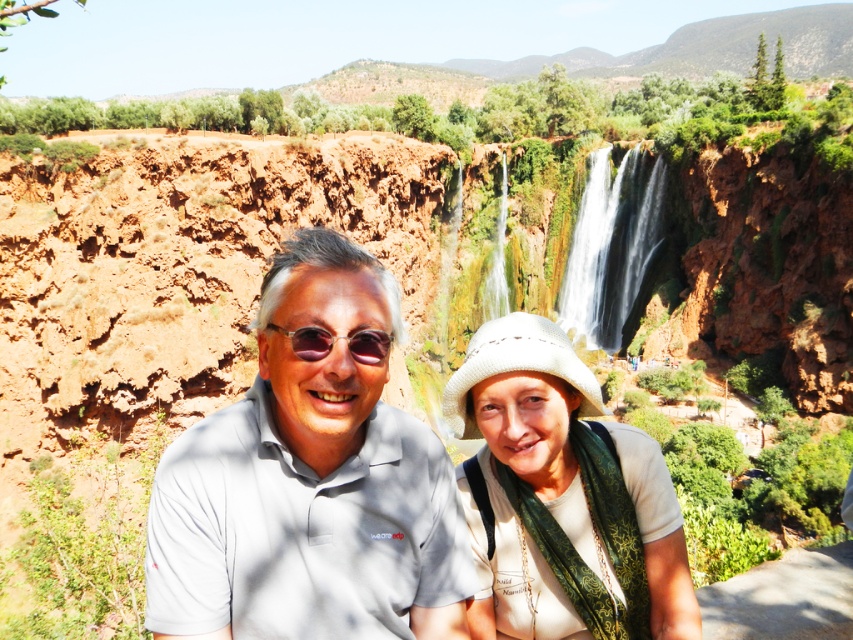
You are a photographer trying to capture the scenic outdoor setting. You notice the white textured waterfall at center and the sunglasses at center. Which object is located higher in the image?

The white textured waterfall at center is positioned over the sunglasses at center, so it is higher in the image.

You are a photographer trying to frame a shot of the two people in the scene. You want to ensure that the white woven hat at center and the sunglasses at center are both visible in the frame. Which object should you prioritize keeping in the frame if you have to choose between them due to limited space?

The white woven hat at center should be prioritized as it is wider than the sunglasses at center, making it more likely to be cut off if space is limited.

You are standing at the base of the waterfall in the scenic outdoor setting. You notice two points marked in the image. Which point, point (462, 369) or point (372, 362), is closer to you?

Point (372, 362) is closer to you because it is less further to the viewer than point (462, 369).